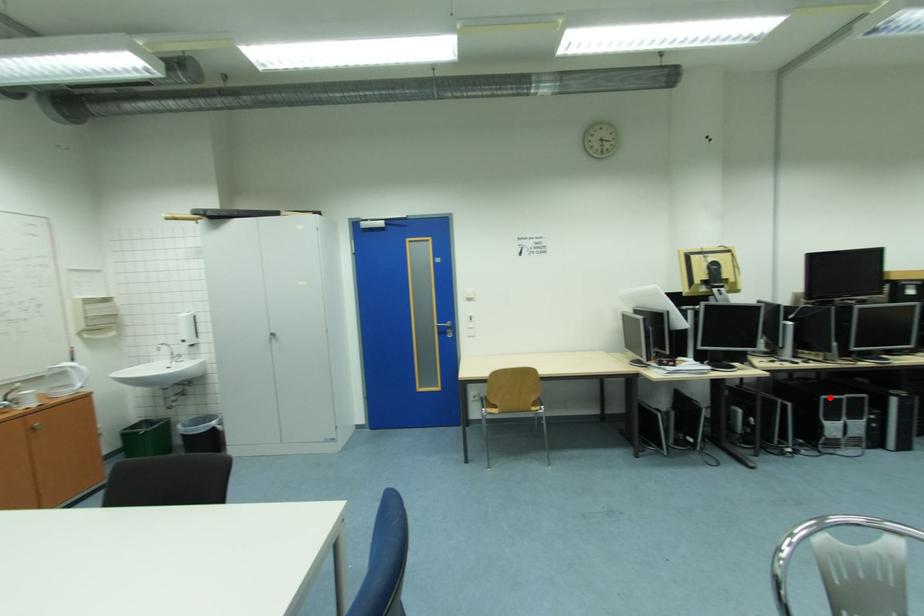
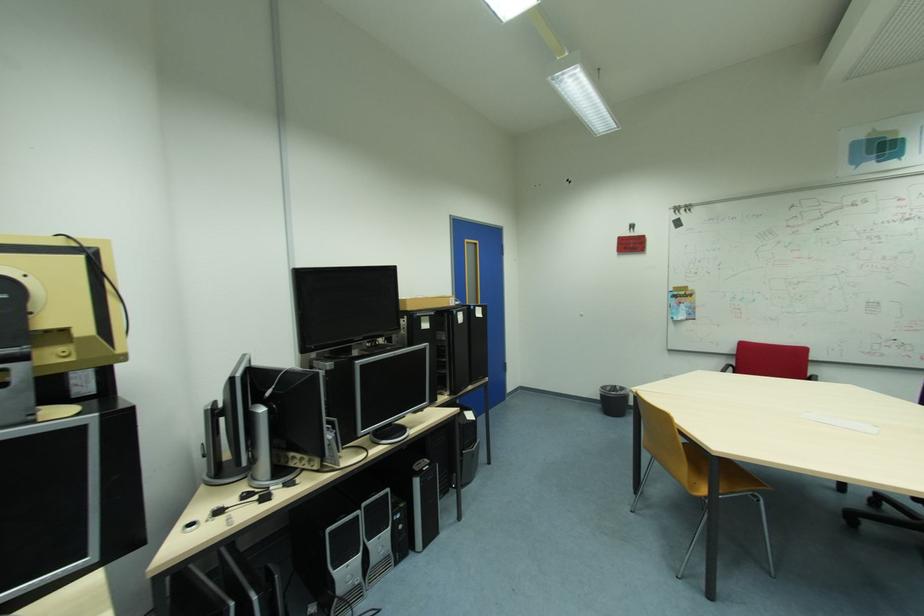
Where in the second image is the point corresponding to the highlighted location from the first image?

(335, 530)